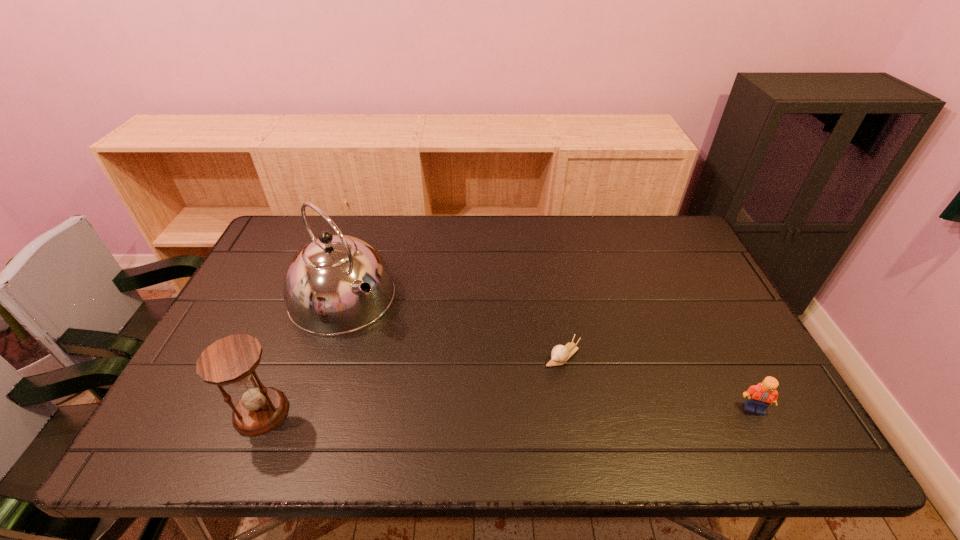
This screenshot has width=960, height=540. Identify the location of vacant space that satisfies the following two spatial constraints: 1. on the back side of the kettle; 2. on the right side of the hourglass. (309, 296).

Locate an element on the screen. The height and width of the screenshot is (540, 960). free space that satisfies the following two spatial constraints: 1. on the back side of the third shortest object; 2. on the right side of the second object from right to left is located at coordinates (285, 355).